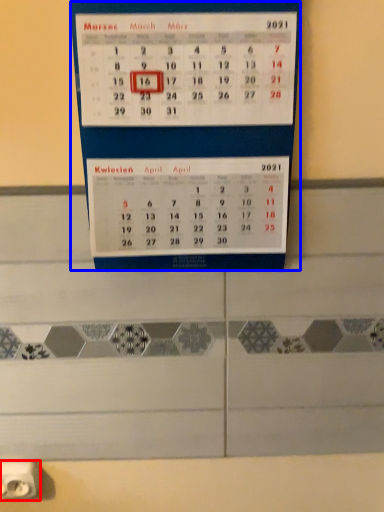
Question: Among these objects, which one is farthest to the camera, power plugs and sockets (highlighted by a red box) or bulletin board (highlighted by a blue box)?

Choices:
 (A) power plugs and sockets
 (B) bulletin board

Answer: (A)